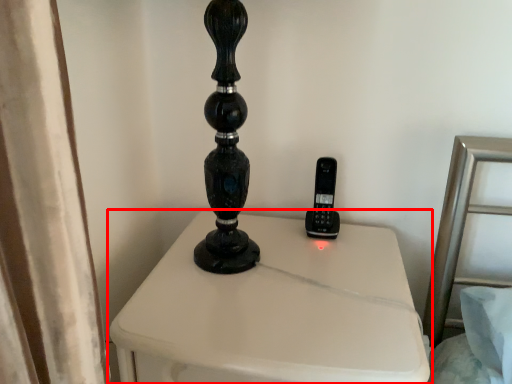
Question: From the image's perspective, where is furniture (annotated by the red box) located in relation to control in the image?

Choices:
 (A) below
 (B) above

Answer: (A)